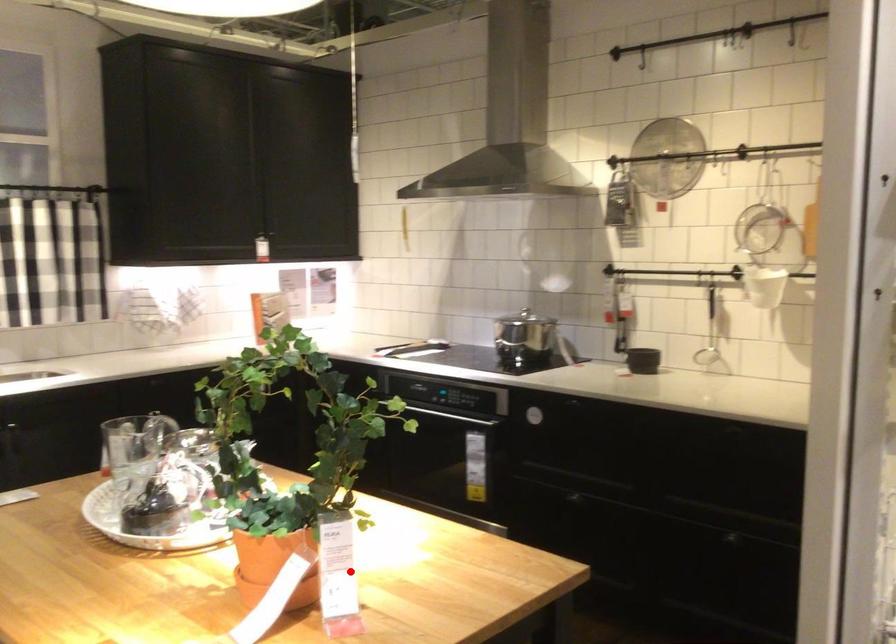
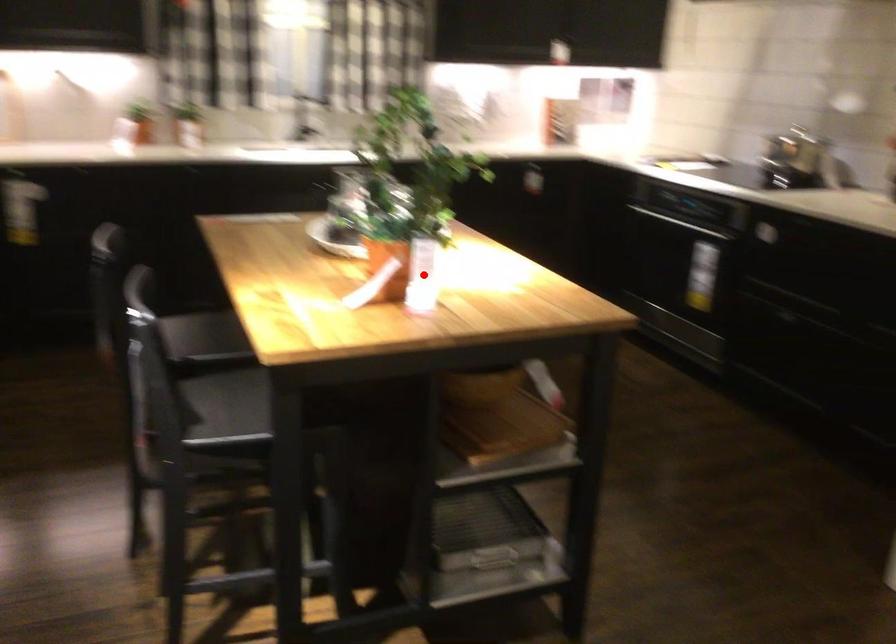
I am providing you with two images of the same scene from different viewpoints. A red point is marked on the first image and another point is marked on the second image. Is the marked point in image1 the same physical position as the marked point in image2?

Yes